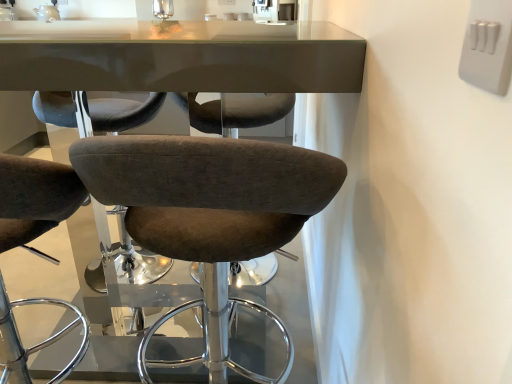
Question: Considering the relative sizes of white glossy sink at upper center and brown fabric stool at center in the image provided, is white glossy sink at upper center bigger than brown fabric stool at center?

Choices:
 (A) yes
 (B) no

Answer: (B)

Question: Considering the relative positions of white glossy sink at upper center and brown fabric stool at center in the image provided, is white glossy sink at upper center in front of brown fabric stool at center?

Choices:
 (A) no
 (B) yes

Answer: (A)

Question: From the image's perspective, does white glossy sink at upper center appear higher than brown fabric stool at center?

Choices:
 (A) yes
 (B) no

Answer: (A)

Question: Considering the relative sizes of white glossy sink at upper center and brown fabric stool at center in the image provided, is white glossy sink at upper center thinner than brown fabric stool at center?

Choices:
 (A) no
 (B) yes

Answer: (B)

Question: Is the surface of white glossy sink at upper center in direct contact with brown fabric stool at center?

Choices:
 (A) yes
 (B) no

Answer: (B)

Question: In the image, is white glossy sink at upper center on the left side or the right side of white plastic switch at upper right?

Choices:
 (A) left
 (B) right

Answer: (A)

Question: Is point (266, 4) closer or farther from the camera than point (472, 3)?

Choices:
 (A) farther
 (B) closer

Answer: (A)

Question: Considering their positions, is white glossy sink at upper center located in front of or behind white plastic switch at upper right?

Choices:
 (A) behind
 (B) front

Answer: (A)

Question: From a real-world perspective, is white glossy sink at upper center positioned above or below white plastic switch at upper right?

Choices:
 (A) above
 (B) below

Answer: (B)

Question: Looking at the image, does white plastic switch at upper right seem bigger or smaller compared to white glossy sink at upper center?

Choices:
 (A) small
 (B) big

Answer: (A)

Question: In terms of width, does white plastic switch at upper right look wider or thinner when compared to white glossy sink at upper center?

Choices:
 (A) wide
 (B) thin

Answer: (B)

Question: From their relative heights in the image, would you say white plastic switch at upper right is taller or shorter than white glossy sink at upper center?

Choices:
 (A) short
 (B) tall

Answer: (A)

Question: Is white plastic switch at upper right inside or outside of white glossy sink at upper center?

Choices:
 (A) outside
 (B) inside

Answer: (A)

Question: Choose the correct answer: Is white glossy sink at upper center inside brown fabric stool at center or outside it?

Choices:
 (A) outside
 (B) inside

Answer: (A)

Question: Is white glossy sink at upper center taller or shorter than brown fabric stool at center?

Choices:
 (A) tall
 (B) short

Answer: (B)